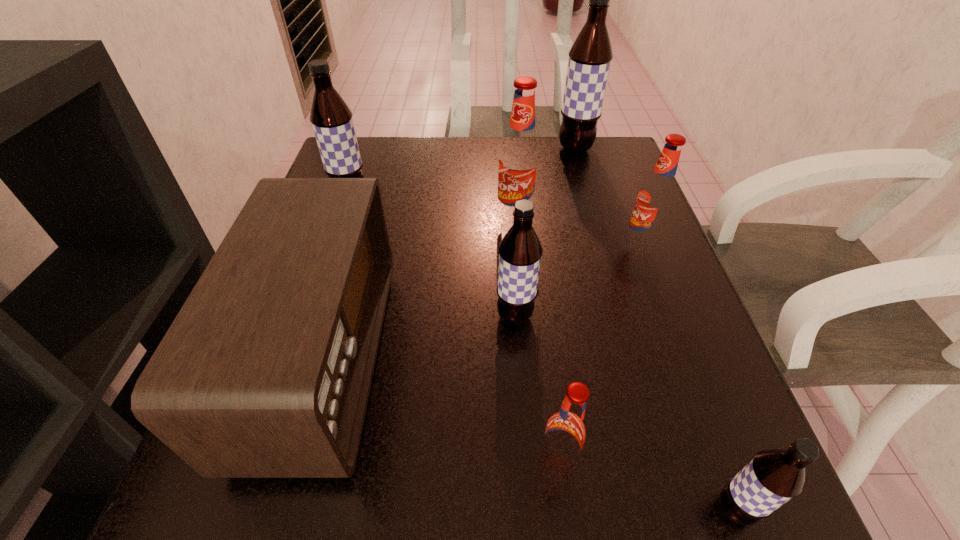
You are a GUI agent. You are given a task and a screenshot of the screen. Output one action in this format:
    pyautogui.click(x=<x>, y=<y>)
    Task: Click on the free space that satisfies the following two spatial constraints: 1. on the front-facing side of the brown radio receiver; 2. on the back side of the second nearest root beer
    This screenshot has height=540, width=960.
    Given the screenshot: What is the action you would take?
    pyautogui.click(x=295, y=460)

At what (x,y) coordinates should I click in order to perform the action: click on free space that satisfies the following two spatial constraints: 1. on the front side of the biggest red root beer; 2. on the right side of the second farthest brown root beer. Please return your answer as a coordinate pair (x, y). The height and width of the screenshot is (540, 960). Looking at the image, I should click on (344, 218).

Identify the location of free space in the image that satisfies the following two spatial constraints: 1. on the front-facing side of the brown radio receiver; 2. on the right side of the smallest brown root beer. [280, 509].

Find the location of `free point that satisfies the following two spatial constraints: 1. on the front side of the second farthest brown root beer; 2. on the left side of the smallest brown root beer`. free point that satisfies the following two spatial constraints: 1. on the front side of the second farthest brown root beer; 2. on the left side of the smallest brown root beer is located at coordinates (245, 509).